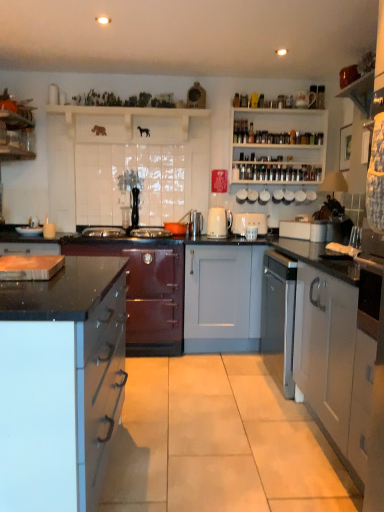
You are a GUI agent. You are given a task and a screenshot of the screen. Output one action in this format:
    pyautogui.click(x=<x>, y=<y>)
    Task: Click on the space that is in front of white glossy kettle at center, the first appliance in the left-to-right sequence
    This screenshot has width=384, height=512.
    Given the screenshot: What is the action you would take?
    pyautogui.click(x=230, y=238)